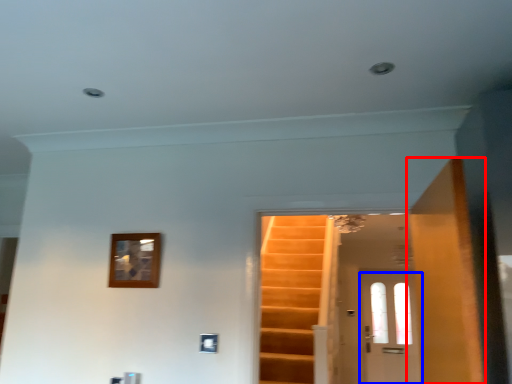
Question: Which point is closer to the camera, door (highlighted by a red box) or door (highlighted by a blue box)?

Choices:
 (A) door
 (B) door

Answer: (A)